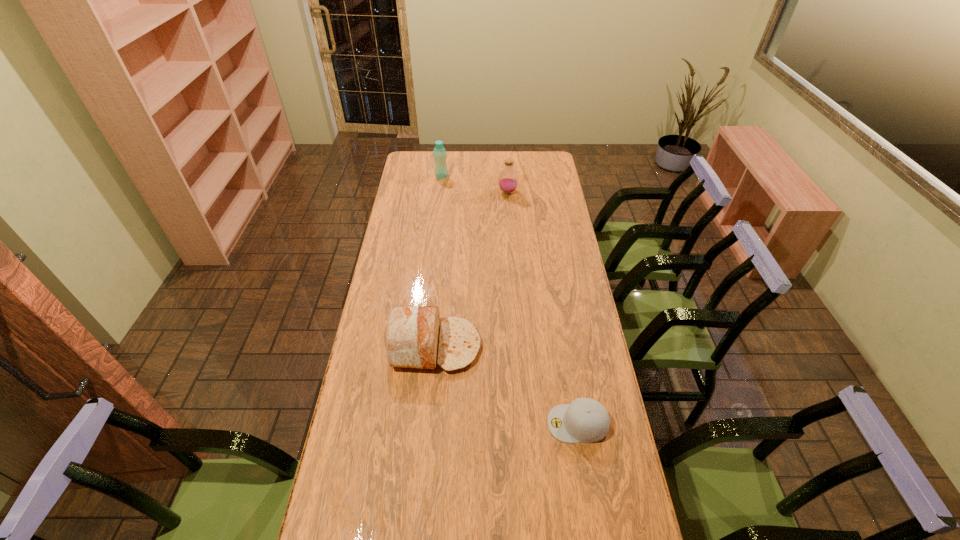
This screenshot has height=540, width=960. I want to click on vacant point located between the farthest object and the cap, so click(x=510, y=300).

Find the location of a particular element. The height and width of the screenshot is (540, 960). free point between the rightmost object and the left bottle is located at coordinates (510, 300).

Select which object appears as the third closest to the third nearest object. Please provide its 2D coordinates. Your answer should be formatted as a tuple, i.e. [(x, y)], where the tuple contains the x and y coordinates of a point satisfying the conditions above.

[(585, 420)]

I want to click on the closest object to the second farthest object, so click(439, 152).

In order to click on vacant area that satisfies the following two spatial constraints: 1. on the front side of the second object from right to left; 2. at the sliced end of the third farthest object in this screenshot , I will do `click(519, 346)`.